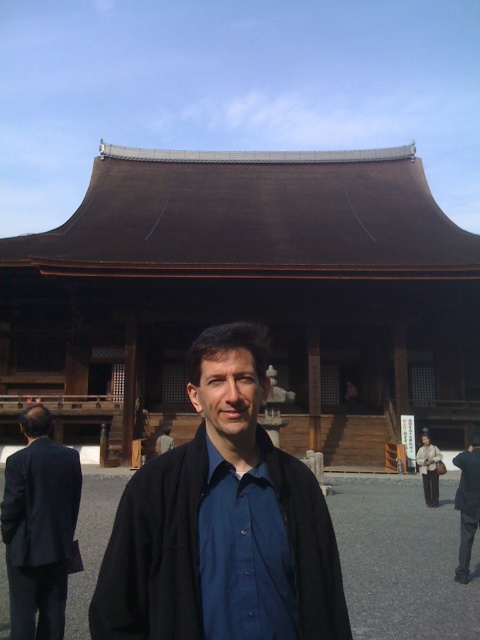
Question: Is dark gray fabric robe at lower right positioned in front of dark blue shirt at center?

Choices:
 (A) yes
 (B) no

Answer: (A)

Question: Can you confirm if matte black jacket at center is bigger than blue smooth shirt at center?

Choices:
 (A) yes
 (B) no

Answer: (B)

Question: Can you confirm if brown wooden temple at center is wider than dark blue shirt at center?

Choices:
 (A) no
 (B) yes

Answer: (B)

Question: Which object appears closest to the camera in this image?

Choices:
 (A) blue smooth shirt at center
 (B) dark gray fabric robe at lower right

Answer: (A)

Question: Which point is closer to the camera?

Choices:
 (A) (163, 452)
 (B) (425, 451)

Answer: (B)

Question: Among these points, which one is nearest to the camera?

Choices:
 (A) (268, 444)
 (B) (56, 451)
 (C) (428, 451)
 (D) (459, 563)

Answer: (A)